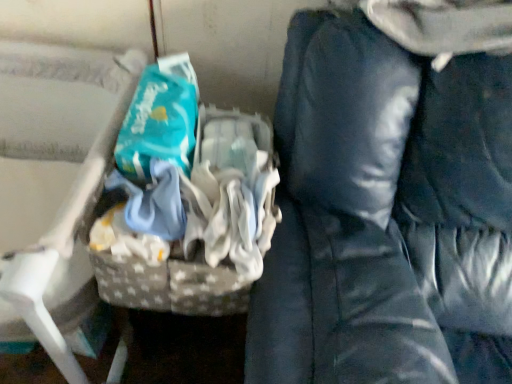
Question: Are teal fabric wipes at center and gray fabric basket at left located far from each other?

Choices:
 (A) no
 (B) yes

Answer: (A)

Question: Considering the relative positions of teal fabric wipes at center and gray fabric basket at left in the image provided, is teal fabric wipes at center to the left of gray fabric basket at left from the viewer's perspective?

Choices:
 (A) yes
 (B) no

Answer: (B)

Question: From a real-world perspective, does teal fabric wipes at center stand above gray fabric basket at left?

Choices:
 (A) yes
 (B) no

Answer: (A)

Question: Can you confirm if teal fabric wipes at center is thinner than gray fabric basket at left?

Choices:
 (A) yes
 (B) no

Answer: (A)

Question: Is teal fabric wipes at center to the right of gray fabric basket at left from the viewer's perspective?

Choices:
 (A) no
 (B) yes

Answer: (B)

Question: From a real-world perspective, is teal fabric wipes at center positioned above or below gray fabric basket at left?

Choices:
 (A) above
 (B) below

Answer: (A)

Question: Considering the positions of teal fabric wipes at center and gray fabric basket at left in the image, is teal fabric wipes at center taller or shorter than gray fabric basket at left?

Choices:
 (A) short
 (B) tall

Answer: (A)

Question: Relative to gray fabric basket at left, is teal fabric wipes at center in front or behind?

Choices:
 (A) behind
 (B) front

Answer: (A)

Question: Is teal fabric wipes at center situated inside gray fabric basket at left or outside?

Choices:
 (A) outside
 (B) inside

Answer: (A)

Question: From a real-world perspective, relative to dark blue fabric bean bag chair at right, is gray fabric basket at left vertically above or below?

Choices:
 (A) below
 (B) above

Answer: (A)

Question: Relative to dark blue fabric bean bag chair at right, is gray fabric basket at left in front or behind?

Choices:
 (A) front
 (B) behind

Answer: (B)

Question: Is gray fabric basket at left spatially inside dark blue fabric bean bag chair at right, or outside of it?

Choices:
 (A) inside
 (B) outside

Answer: (B)

Question: Is gray fabric basket at left bigger or smaller than dark blue fabric bean bag chair at right?

Choices:
 (A) big
 (B) small

Answer: (B)

Question: From a real-world perspective, is dark blue fabric bean bag chair at right above or below gray fabric basket at left?

Choices:
 (A) above
 (B) below

Answer: (A)

Question: Is dark blue fabric bean bag chair at right to the left or to the right of gray fabric basket at left in the image?

Choices:
 (A) right
 (B) left

Answer: (A)